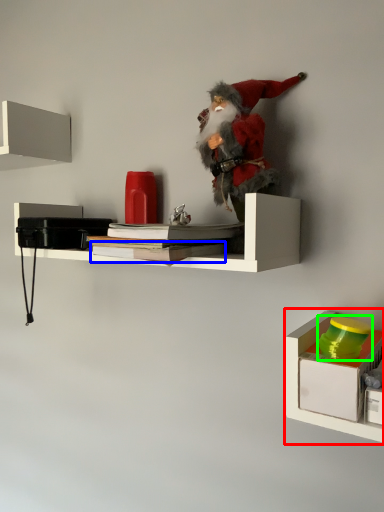
Question: Which object is positioned closest to shelf (highlighted by a red box)? Select from book (highlighted by a blue box) and toy (highlighted by a green box).

Choices:
 (A) book
 (B) toy

Answer: (B)